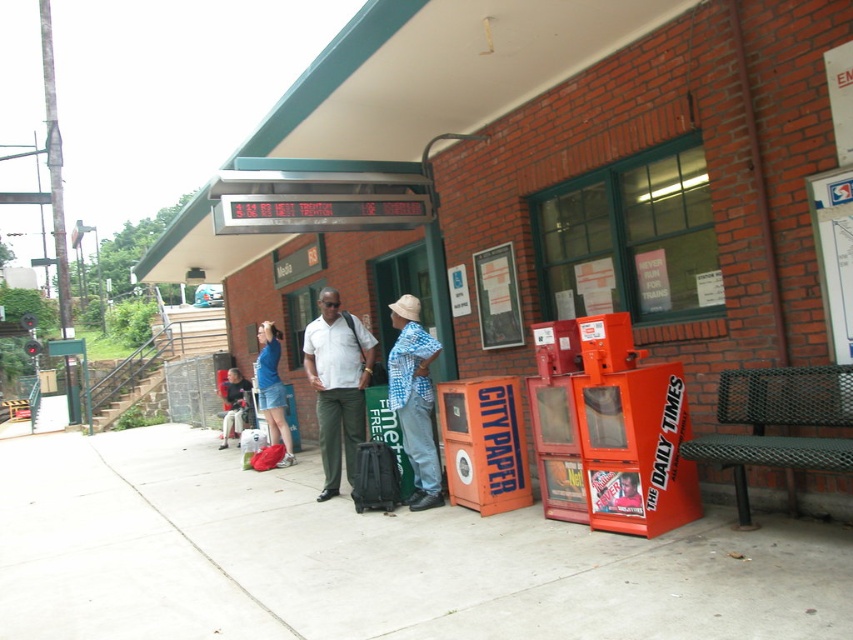
Question: Which point is farther to the camera?

Choices:
 (A) (276, 403)
 (B) (219, 548)

Answer: (A)

Question: Is checkered fabric shirt at center further to camera compared to denim shorts at center?

Choices:
 (A) no
 (B) yes

Answer: (A)

Question: Observing the image, what is the correct spatial positioning of matte black shirt at center in reference to denim shorts at center?

Choices:
 (A) above
 (B) below

Answer: (A)

Question: Among these points, which one is nearest to the camera?

Choices:
 (A) (432, 433)
 (B) (230, 378)

Answer: (A)

Question: Can you confirm if concrete at center is thinner than matte black shirt at center?

Choices:
 (A) yes
 (B) no

Answer: (B)

Question: Based on their relative distances, which object is farther from the concrete at center?

Choices:
 (A) matte blue denim shorts at center
 (B) checkered fabric shirt at center
 (C) denim shorts at center

Answer: (C)